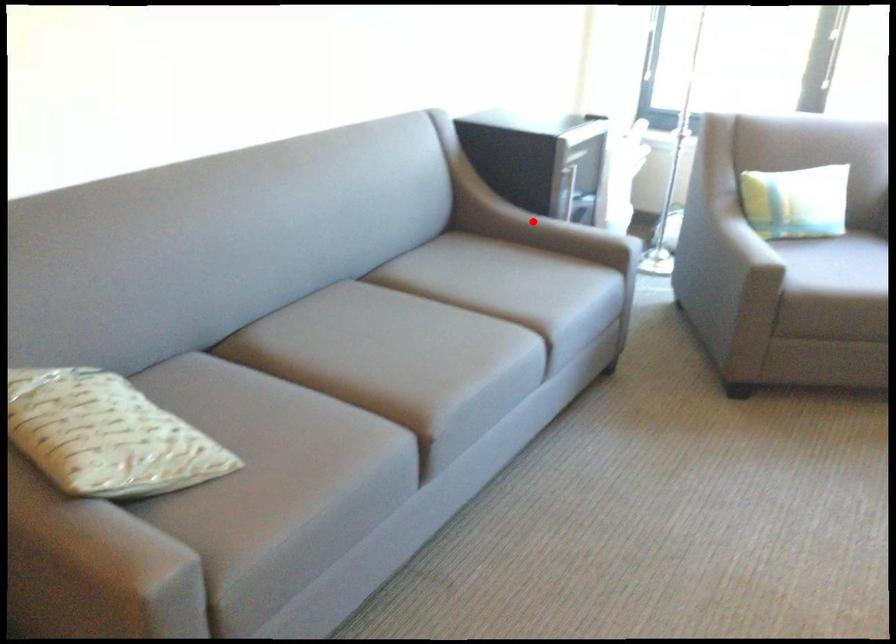
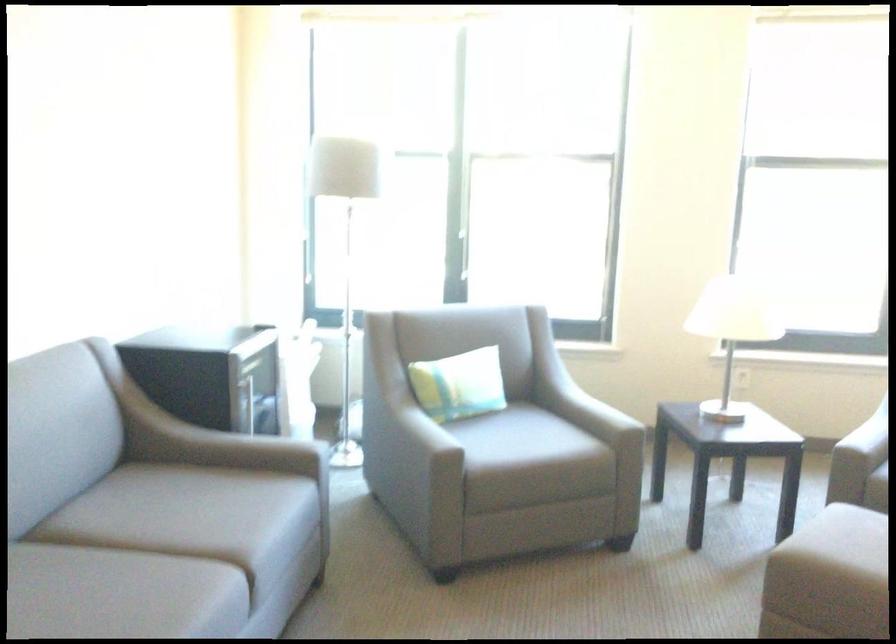
Where in the second image is the point corresponding to the highlighted location from the first image?

(211, 444)